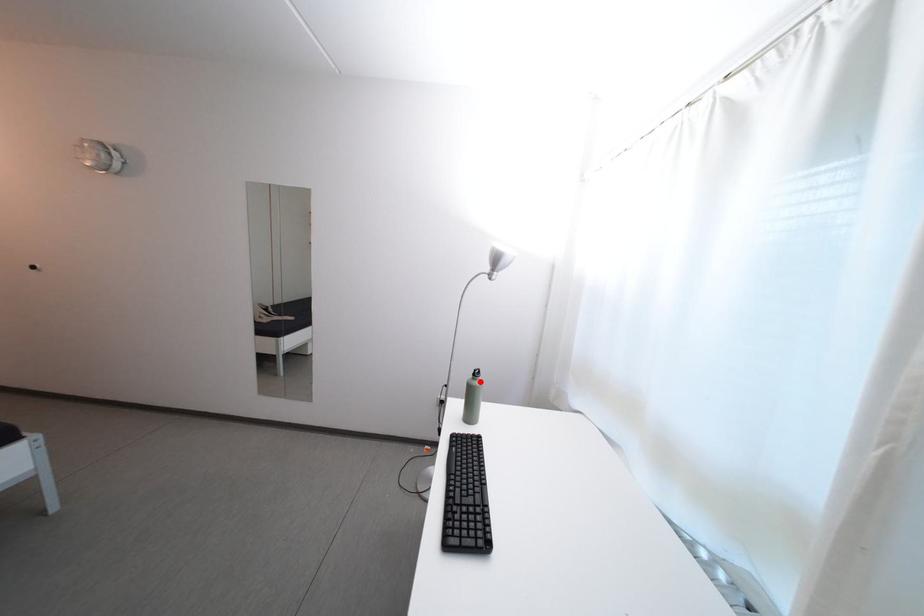
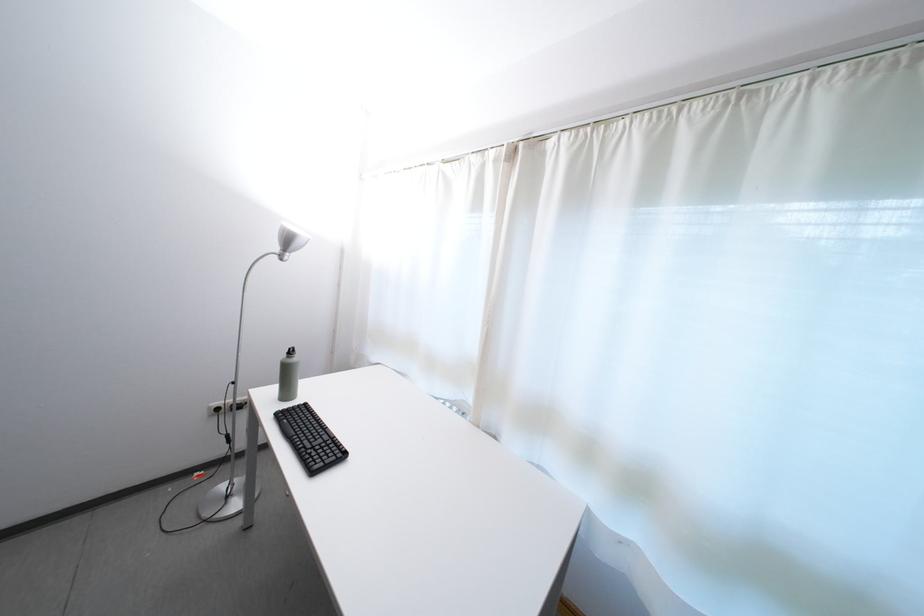
Question: I am providing you with two images of the same scene from different viewpoints. In image1, a red point is highlighted. Considering the same 3D point in image2, which of the following is correct?

Choices:
 (A) It is closer
 (B) It is farther

Answer: (A)